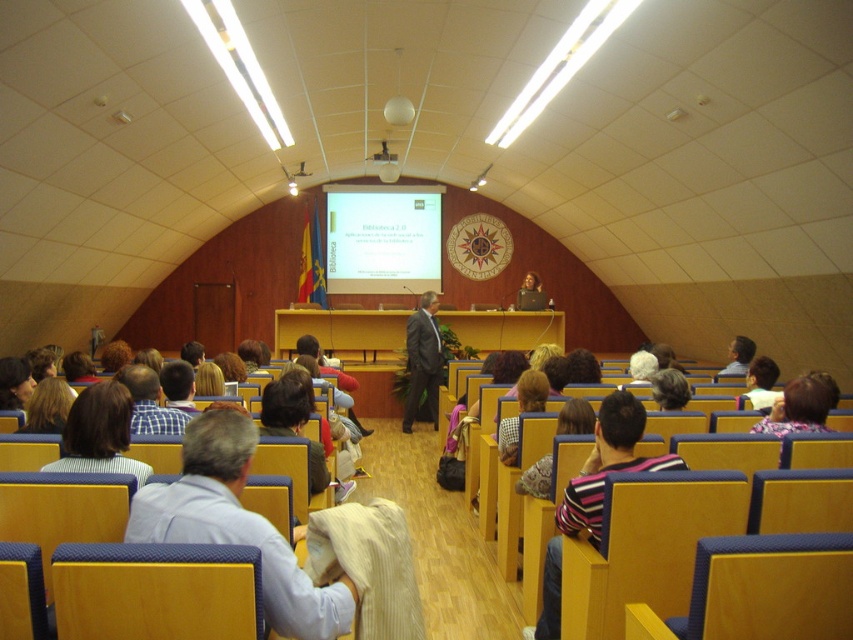
Question: Does striped fabric bag at center appear under striped fabric shirt at right?

Choices:
 (A) no
 (B) yes

Answer: (B)

Question: Which point is closer to the camera taking this photo?

Choices:
 (A) (556, 548)
 (B) (433, 337)
 (C) (235, 452)

Answer: (C)

Question: In this image, where is dark gray suit at center located relative to matte black laptop at center?

Choices:
 (A) below
 (B) above

Answer: (A)

Question: Which of the following is the closest to the observer?

Choices:
 (A) (57, 388)
 (B) (194, 536)

Answer: (B)

Question: Which point is farther to the camera?

Choices:
 (A) (335, 216)
 (B) (73, 454)
 (C) (776, 413)

Answer: (A)

Question: Is dark gray suit at center behind light brown hair at lower left?

Choices:
 (A) no
 (B) yes

Answer: (B)